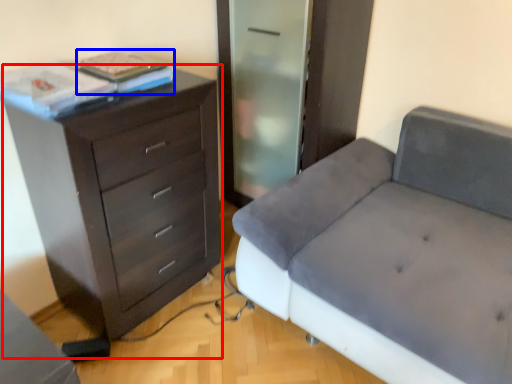
Question: Which of the following is the closest to the observer, chest of drawers (highlighted by a red box) or book (highlighted by a blue box)?

Choices:
 (A) chest of drawers
 (B) book

Answer: (A)